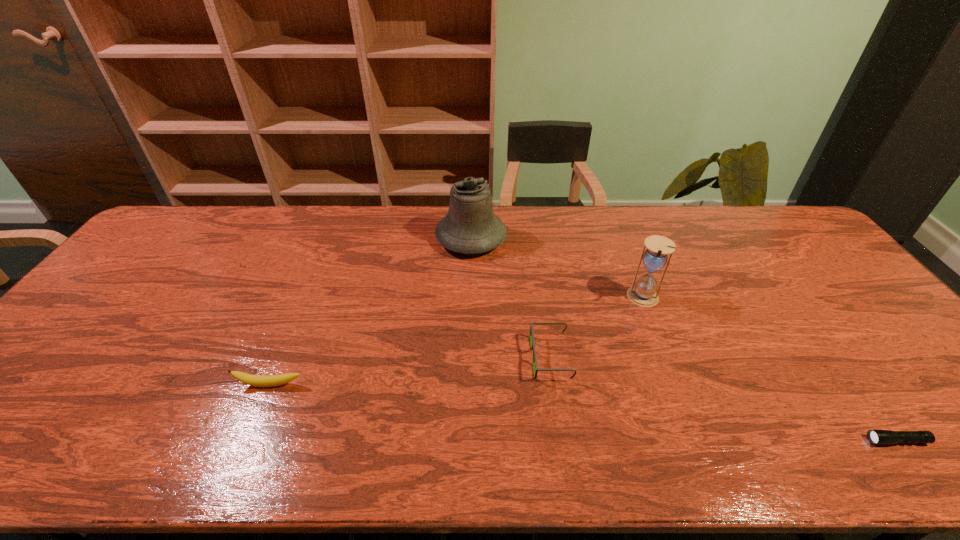
At what (x,y) coordinates should I click in order to perform the action: click on object situated at the near right corner. Please return your answer as a coordinate pair (x, y). Looking at the image, I should click on (877, 437).

In the image, there is a desktop. At what (x,y) coordinates should I click in order to perform the action: click on vacant space at the far edge. Please return your answer as a coordinate pair (x, y). This screenshot has height=540, width=960. Looking at the image, I should click on (509, 206).

In the image, there is a desktop. Where is `vacant space at the near edge`? vacant space at the near edge is located at coordinates pos(653,429).

The width and height of the screenshot is (960, 540). I want to click on vacant space at the left edge of the desktop, so click(x=143, y=279).

In the image, there is a desktop. Find the location of `vacant space at the right edge`. vacant space at the right edge is located at coordinates (828, 276).

You are a GUI agent. You are given a task and a screenshot of the screen. Output one action in this format:
    pyautogui.click(x=<x>, y=<y>)
    Task: Click on the vacant area at the far left corner
    This screenshot has width=960, height=540.
    Given the screenshot: What is the action you would take?
    pyautogui.click(x=156, y=231)

Where is `vacant space in between the banana and the fourth object from left to right`? vacant space in between the banana and the fourth object from left to right is located at coordinates (457, 341).

The height and width of the screenshot is (540, 960). Find the location of `free space between the leftmost object and the spectacles`. free space between the leftmost object and the spectacles is located at coordinates (411, 371).

The height and width of the screenshot is (540, 960). Identify the location of free space between the leftmost object and the shortest object. (584, 413).

The image size is (960, 540). Find the location of `vacant region between the second object from left to right and the rightmost object`. vacant region between the second object from left to right and the rightmost object is located at coordinates (684, 339).